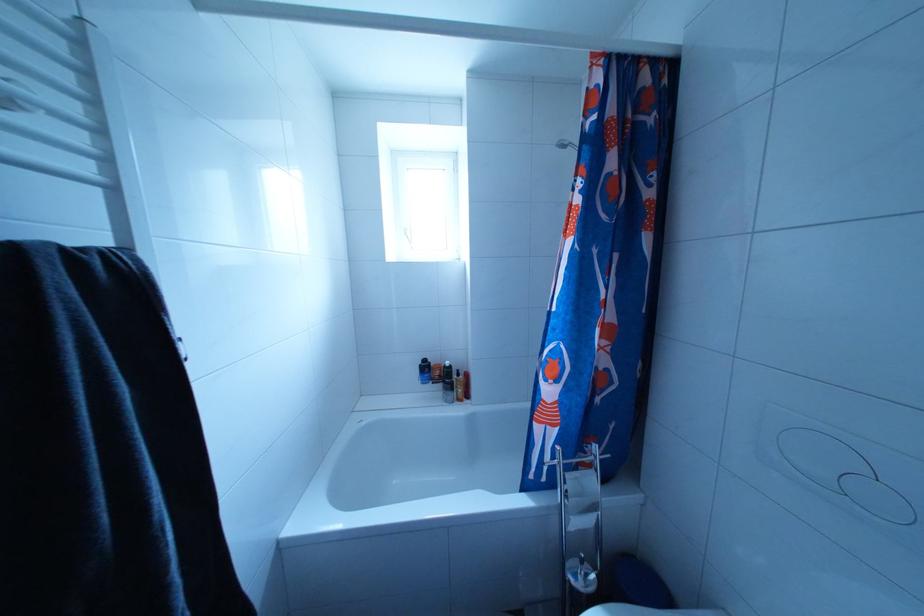
Find where to lift the chrome toilet paper holder. Please return your answer as a coordinate pair (x, y).

(578, 528)